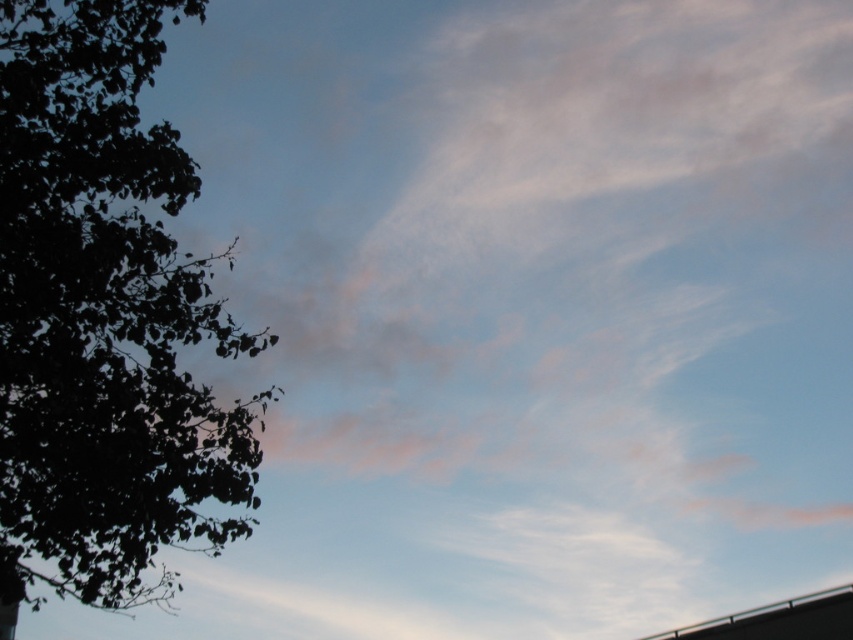
Is dark green leafy tree at left smaller than metallic gray overpass at bottom right?

Actually, dark green leafy tree at left might be larger than metallic gray overpass at bottom right.

Is point (49, 12) farther from camera compared to point (757, 625)?

No, (49, 12) is closer to viewer.

Locate an element on the screen. The image size is (853, 640). dark green leafy tree at left is located at coordinates (103, 316).